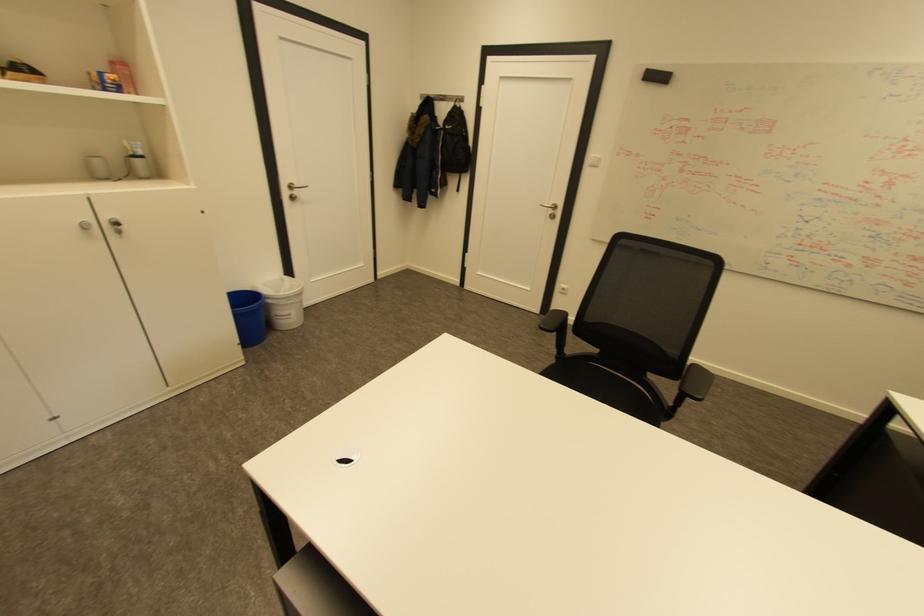
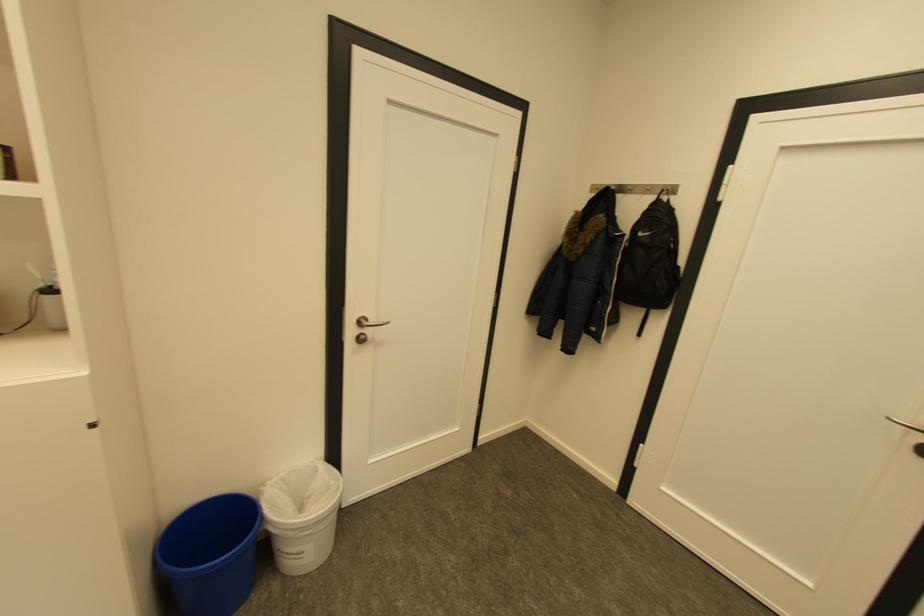
In the second image, find the point that corresponds to [272,285] in the first image.

(289, 477)